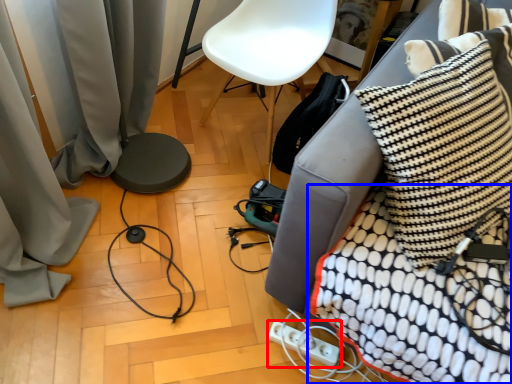
Question: Among these objects, which one is farthest to the camera, electric outlet (highlighted by a red box) or blanket (highlighted by a blue box)?

Choices:
 (A) electric outlet
 (B) blanket

Answer: (A)